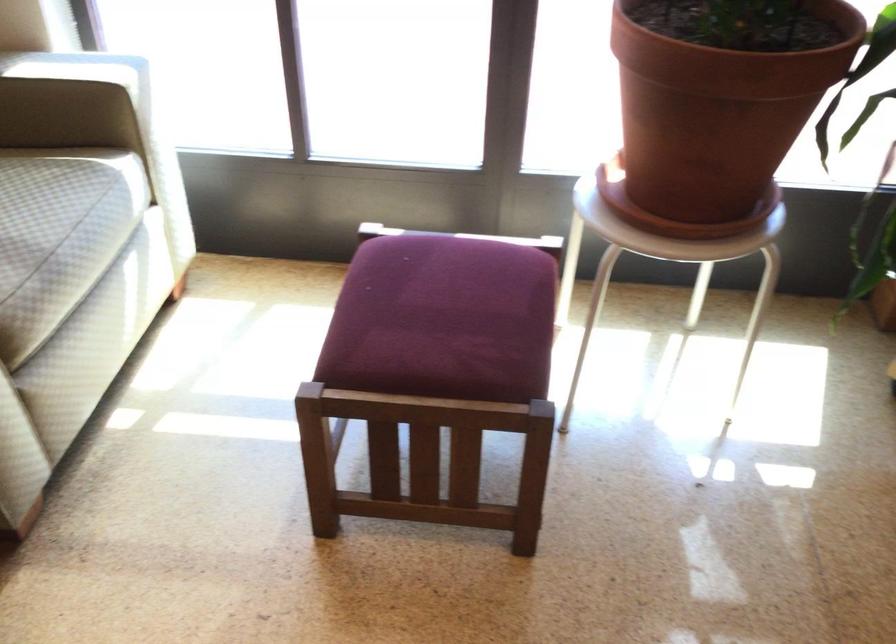
Identify the location of chair sitting surface. (451, 308).